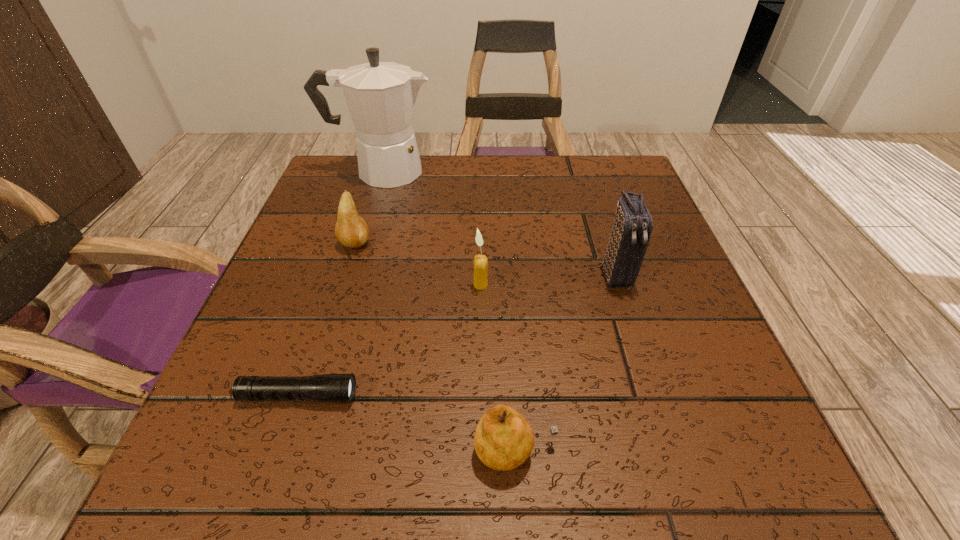
Where is `the tallest object`? Image resolution: width=960 pixels, height=540 pixels. the tallest object is located at coordinates (381, 96).

At what (x,y) coordinates should I click in order to perform the action: click on the farthest object. Please return your answer as a coordinate pair (x, y). Image resolution: width=960 pixels, height=540 pixels. Looking at the image, I should click on (381, 96).

Where is `the second tallest object`? The height and width of the screenshot is (540, 960). the second tallest object is located at coordinates (633, 224).

The height and width of the screenshot is (540, 960). I want to click on clutch bag, so [x=633, y=224].

You are a GUI agent. You are given a task and a screenshot of the screen. Output one action in this format:
    pyautogui.click(x=<x>, y=<y>)
    Task: Click on the candle
    
    Given the screenshot: What is the action you would take?
    pyautogui.click(x=480, y=264)

The width and height of the screenshot is (960, 540). Identify the location of the second farthest object. (351, 230).

Locate an element on the screen. the left pear is located at coordinates (351, 230).

Where is `the fifth tallest object`? the fifth tallest object is located at coordinates pyautogui.click(x=503, y=440).

Find the location of a particular element. The image size is (960, 540). the shorter pear is located at coordinates [503, 440].

I want to click on flashlight, so click(x=337, y=388).